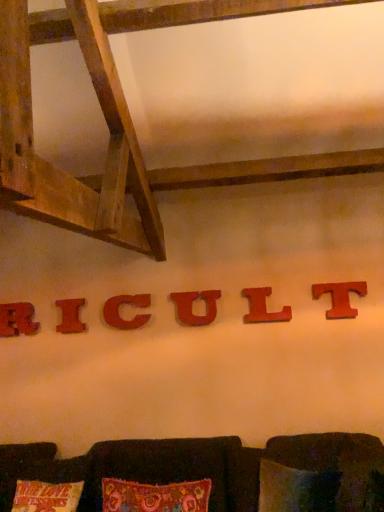
Where is `wooden letter c at center, placed as the 3th alphabet when sorted from left to right`? This screenshot has height=512, width=384. wooden letter c at center, placed as the 3th alphabet when sorted from left to right is located at coordinates (119, 311).

Identify the location of red matte u at center, the 3th alphabet when ordered from right to left. The width and height of the screenshot is (384, 512). (192, 307).

At what (x,y) coordinates should I click in order to perform the action: click on wooden letter c at center, the fourth alphabet viewed from the right. Please return your answer as a coordinate pair (x, y). This screenshot has width=384, height=512. Looking at the image, I should click on (119, 311).

Which point is more forward, (63, 319) or (131, 326)?

Point (131, 326)

How many degrees apart are the facing directions of wooden letter "i" at center, acting as the fifth alphabet starting from the right, and wooden letter c at center, placed as the 3th alphabet when sorted from left to right?

They differ by 0.349 degrees in their facing directions.

Is wooden letter "i" at center, acting as the fifth alphabet starting from the right, inside or outside of wooden letter c at center, placed as the 3th alphabet when sorted from left to right?

wooden letter "i" at center, acting as the fifth alphabet starting from the right, is not inside wooden letter c at center, placed as the 3th alphabet when sorted from left to right, it's outside.

From the image's perspective, who appears lower, wooden letter "i" at center, the 2th alphabet in the left-to-right sequence, or wooden letter c at center, placed as the 3th alphabet when sorted from left to right?

wooden letter "i" at center, the 2th alphabet in the left-to-right sequence, from the image's perspective.

How much distance is there between red wood letter t at center right, which is counted as the sixth alphabet, starting from the left, and wooden letter r at center, which ranks as the first alphabet in left-to-right order?

red wood letter t at center right, which is counted as the sixth alphabet, starting from the left, and wooden letter r at center, which ranks as the first alphabet in left-to-right order, are 2.10 meters apart from each other.

From a real-world perspective, is red wood letter t at center right, which is counted as the first alphabet, starting from the right, positioned under wooden letter r at center, which appears as the 6th alphabet when viewed from the right, based on gravity?

Actually, red wood letter t at center right, which is counted as the first alphabet, starting from the right, is physically above wooden letter r at center, which appears as the 6th alphabet when viewed from the right, in the real world.

Does red wood letter t at center right, which is counted as the sixth alphabet, starting from the left, have a greater width compared to wooden letter r at center, which ranks as the first alphabet in left-to-right order?

No.

From the image's perspective, which object appears higher, red wood letter t at center right, which is counted as the sixth alphabet, starting from the left, or wooden letter r at center, which ranks as the first alphabet in left-to-right order?

red wood letter t at center right, which is counted as the sixth alphabet, starting from the left.

Between red matte letter l at center, the fifth alphabet viewed from the left, and brown fabric couch at lower center, which one appears on the right side from the viewer's perspective?

From the viewer's perspective, red matte letter l at center, the fifth alphabet viewed from the left, appears more on the right side.

Looking at this image, is red matte letter l at center, the second alphabet from the right, far away from brown fabric couch at lower center?

Absolutely, red matte letter l at center, the second alphabet from the right, is distant from brown fabric couch at lower center.

Starting from the brown fabric couch at lower center, which alphabet is the 2nd one to the right? Please provide its 2D coordinates.

[(263, 307)]

From a real-world perspective, is red wood letter t at center right, which is counted as the first alphabet, starting from the right, on wooden letter "i" at center, the 2th alphabet in the left-to-right sequence?

Yes, from a real-world perspective, red wood letter t at center right, which is counted as the first alphabet, starting from the right, is over wooden letter "i" at center, the 2th alphabet in the left-to-right sequence

Which object is more forward, red wood letter t at center right, which is counted as the sixth alphabet, starting from the left, or wooden letter "i" at center, the 2th alphabet in the left-to-right sequence?

Positioned in front is red wood letter t at center right, which is counted as the sixth alphabet, starting from the left.

From the image's perspective, which is below, red wood letter t at center right, which is counted as the sixth alphabet, starting from the left, or wooden letter "i" at center, the 2th alphabet in the left-to-right sequence?

wooden letter "i" at center, the 2th alphabet in the left-to-right sequence, from the image's perspective.

From the picture: Which point is more distant from viewer, [332,290] or [70,307]?

Point [70,307]

From a real-world perspective, is wooden letter c at center, placed as the 3th alphabet when sorted from left to right, beneath wooden letter "i" at center, acting as the fifth alphabet starting from the right?

Actually, wooden letter c at center, placed as the 3th alphabet when sorted from left to right, is physically above wooden letter "i" at center, acting as the fifth alphabet starting from the right, in the real world.

How many degrees apart are the facing directions of wooden letter c at center, placed as the 3th alphabet when sorted from left to right, and wooden letter "i" at center, the 2th alphabet in the left-to-right sequence?

There is a 0.349-degree angle between the facing directions of wooden letter c at center, placed as the 3th alphabet when sorted from left to right, and wooden letter "i" at center, the 2th alphabet in the left-to-right sequence.

Can you confirm if wooden letter c at center, the fourth alphabet viewed from the right, is positioned to the right of wooden letter "i" at center, acting as the fifth alphabet starting from the right?

Correct, you'll find wooden letter c at center, the fourth alphabet viewed from the right, to the right of wooden letter "i" at center, acting as the fifth alphabet starting from the right.

Are wooden letter c at center, placed as the 3th alphabet when sorted from left to right, and wooden letter "i" at center, the 2th alphabet in the left-to-right sequence, making contact?

No, wooden letter c at center, placed as the 3th alphabet when sorted from left to right, is not making contact with wooden letter "i" at center, the 2th alphabet in the left-to-right sequence.

Is red wood letter t at center right, which is counted as the first alphabet, starting from the right, positioned with its back to wooden letter c at center, the fourth alphabet viewed from the right?

No.

In terms of size, does red wood letter t at center right, which is counted as the first alphabet, starting from the right, appear bigger or smaller than wooden letter c at center, the fourth alphabet viewed from the right?

red wood letter t at center right, which is counted as the first alphabet, starting from the right, is smaller than wooden letter c at center, the fourth alphabet viewed from the right.

From the image's perspective, is red wood letter t at center right, which is counted as the first alphabet, starting from the right, above or below wooden letter c at center, placed as the 3th alphabet when sorted from left to right?

red wood letter t at center right, which is counted as the first alphabet, starting from the right, is situated higher than wooden letter c at center, placed as the 3th alphabet when sorted from left to right, in the image.

Is wooden letter r at center, which ranks as the first alphabet in left-to-right order, inside wooden letter "i" at center, the 2th alphabet in the left-to-right sequence?

No.

Is wooden letter "i" at center, acting as the fifth alphabet starting from the right, taller than wooden letter r at center, which ranks as the first alphabet in left-to-right order?

Incorrect, the height of wooden letter "i" at center, acting as the fifth alphabet starting from the right, is not larger of that of wooden letter r at center, which ranks as the first alphabet in left-to-right order.

Locate an element on the screen. This screenshot has height=512, width=384. alphabet below the wooden letter c at center, the fourth alphabet viewed from the right (from a real-world perspective) is located at coordinates (70, 316).

Starting from the wooden letter r at center, which ranks as the first alphabet in left-to-right order, which alphabet is the 5th one in front? Please provide its 2D coordinates.

[(340, 297)]

Looking at the image, which one is located closer to wooden letter c at center, placed as the 3th alphabet when sorted from left to right, red matte u at center, the 3th alphabet when ordered from right to left, or wooden letter "i" at center, the 2th alphabet in the left-to-right sequence?

The object closer to wooden letter c at center, placed as the 3th alphabet when sorted from left to right, is wooden letter "i" at center, the 2th alphabet in the left-to-right sequence.

Considering their positions, is red matte letter l at center, the second alphabet from the right, positioned further to red wood letter t at center right, which is counted as the first alphabet, starting from the right, than wooden letter c at center, the fourth alphabet viewed from the right?

Based on the image, wooden letter c at center, the fourth alphabet viewed from the right, appears to be further to red wood letter t at center right, which is counted as the first alphabet, starting from the right.

From the image, which object appears to be farther from red wood letter t at center right, which is counted as the first alphabet, starting from the right, red matte u at center, which ranks as the 4th alphabet in left-to-right order, or wooden letter "i" at center, acting as the fifth alphabet starting from the right?

wooden letter "i" at center, acting as the fifth alphabet starting from the right, lies further to red wood letter t at center right, which is counted as the first alphabet, starting from the right, than the other object.

Based on their spatial positions, is brown fabric couch at lower center or wooden letter "i" at center, acting as the fifth alphabet starting from the right, closer to red wood letter t at center right, which is counted as the first alphabet, starting from the right?

Among the two, brown fabric couch at lower center is located nearer to red wood letter t at center right, which is counted as the first alphabet, starting from the right.

Based on their spatial positions, is wooden letter r at center, which ranks as the first alphabet in left-to-right order, or red matte letter l at center, the fifth alphabet viewed from the left, closer to wooden letter c at center, placed as the 3th alphabet when sorted from left to right?

wooden letter r at center, which ranks as the first alphabet in left-to-right order.

From the image, which object appears to be nearer to wooden letter c at center, the fourth alphabet viewed from the right, wooden letter "i" at center, the 2th alphabet in the left-to-right sequence, or red matte letter l at center, the second alphabet from the right?

Among the two, wooden letter "i" at center, the 2th alphabet in the left-to-right sequence, is located nearer to wooden letter c at center, the fourth alphabet viewed from the right.

Which object lies nearer to the anchor point brown fabric couch at lower center, wooden letter c at center, placed as the 3th alphabet when sorted from left to right, or red wood letter t at center right, which is counted as the sixth alphabet, starting from the left?

wooden letter c at center, placed as the 3th alphabet when sorted from left to right, is positioned closer to the anchor brown fabric couch at lower center.

When comparing their distances from red matte letter l at center, the fifth alphabet viewed from the left, does brown fabric couch at lower center or red matte u at center, which ranks as the 4th alphabet in left-to-right order, seem further?

brown fabric couch at lower center lies further to red matte letter l at center, the fifth alphabet viewed from the left, than the other object.

I want to click on furniture between wooden letter "i" at center, acting as the fifth alphabet starting from the right, and red wood letter t at center right, which is counted as the first alphabet, starting from the right, from left to right, so click(x=205, y=467).

Locate an element on the screen. This screenshot has width=384, height=512. alphabet between wooden letter r at center, which ranks as the first alphabet in left-to-right order, and wooden letter c at center, placed as the 3th alphabet when sorted from left to right, from left to right is located at coordinates (70, 316).

Where is `alphabet between red matte u at center, the 3th alphabet when ordered from right to left, and red wood letter t at center right, which is counted as the first alphabet, starting from the right`? This screenshot has height=512, width=384. alphabet between red matte u at center, the 3th alphabet when ordered from right to left, and red wood letter t at center right, which is counted as the first alphabet, starting from the right is located at coordinates (263, 307).

The image size is (384, 512). In order to click on alphabet between wooden letter "i" at center, the 2th alphabet in the left-to-right sequence, and red matte u at center, the 3th alphabet when ordered from right to left in this screenshot , I will do `click(119, 311)`.